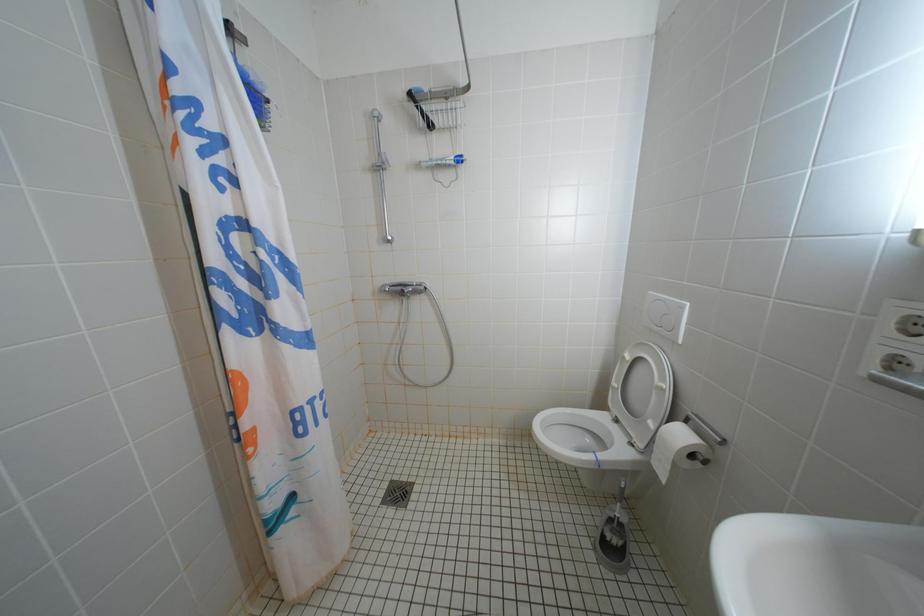
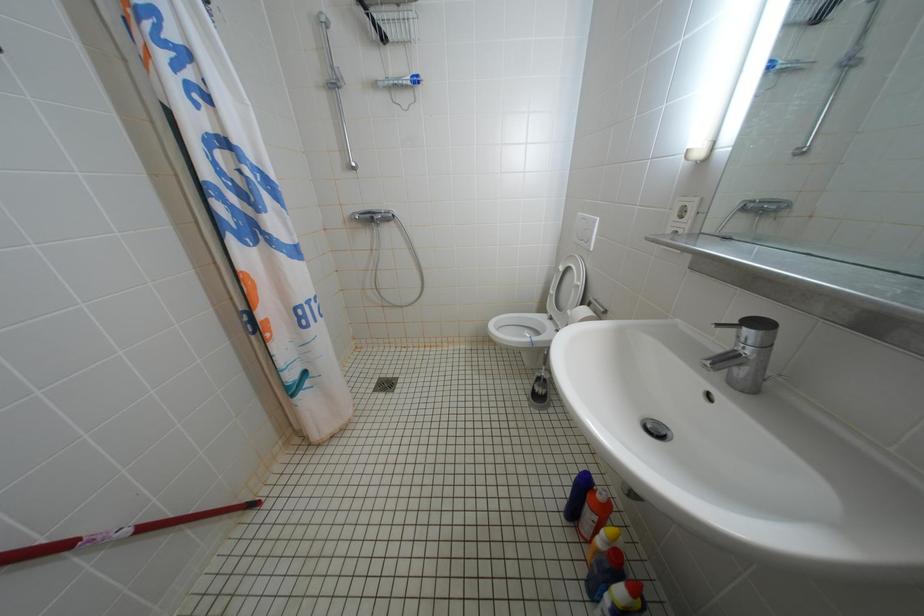
Question: The images are taken continuously from a first-person perspective. In which direction is your viewpoint rotating?

Choices:
 (A) Left
 (B) Right
 (C) Up
 (D) Down

Answer: (D)